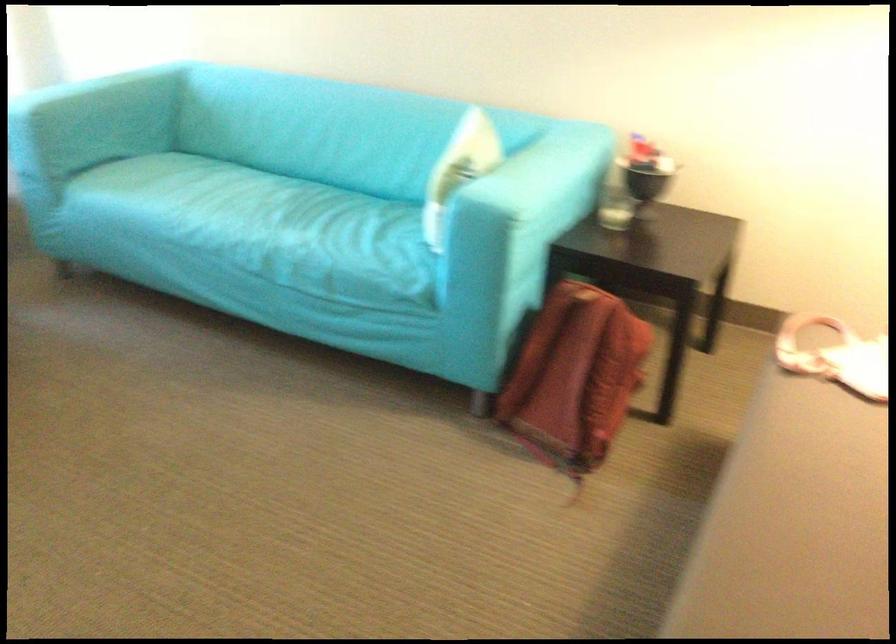
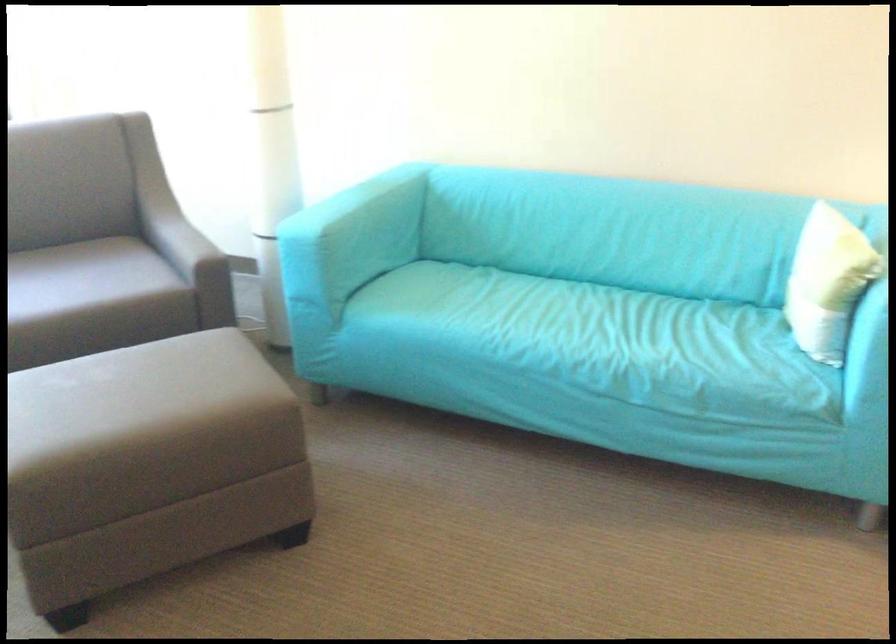
In the second image, find the point that corresponds to the point at 440,176 in the first image.

(825, 281)